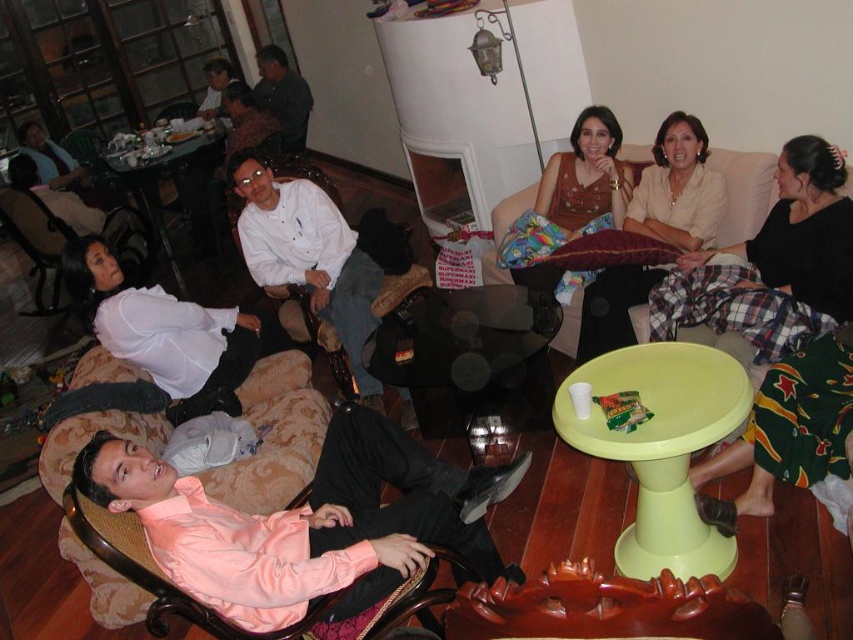
You are organizing a charity event and need to display two blouses on a mannequin. The white satin blouse at lower left and the matte beige blouse at center are available. Which blouse should you choose if you want the one that appears bigger?

The white satin blouse at lower left has a larger size compared to the matte beige blouse at center, so you should choose the white satin blouse at lower left.